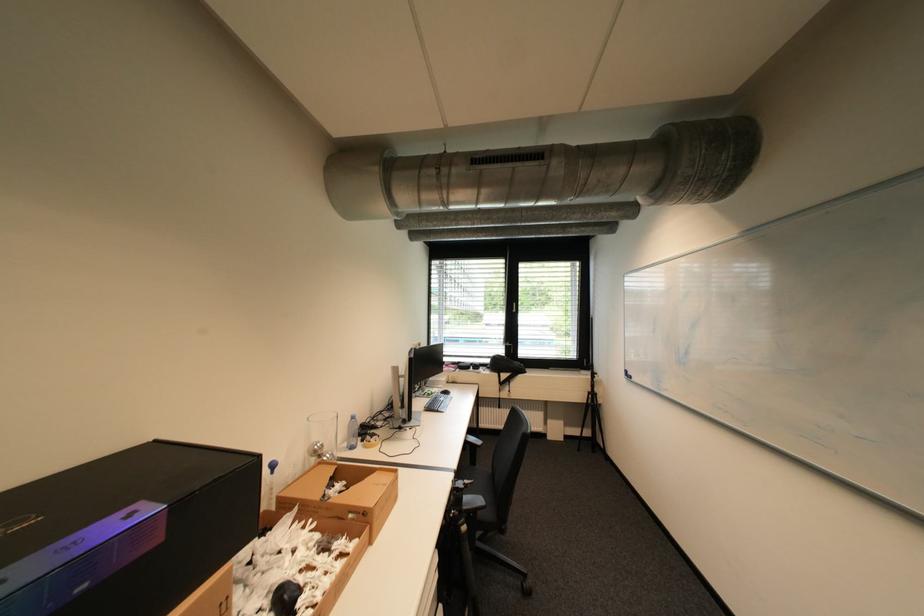
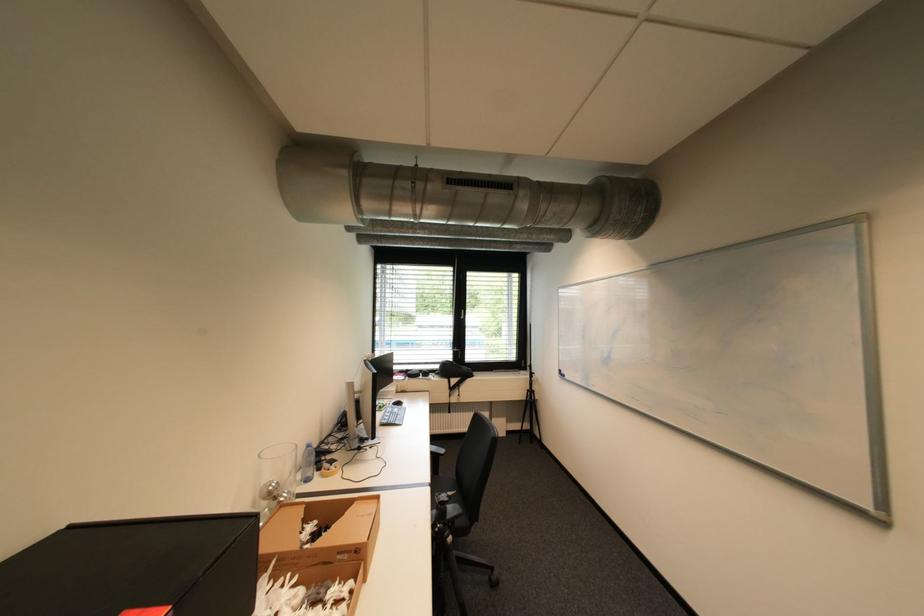
Question: The images are taken continuously from a first-person perspective. In which direction are you moving?

Choices:
 (A) Left
 (B) Right
 (C) Forward
 (D) Backward

Answer: (A)